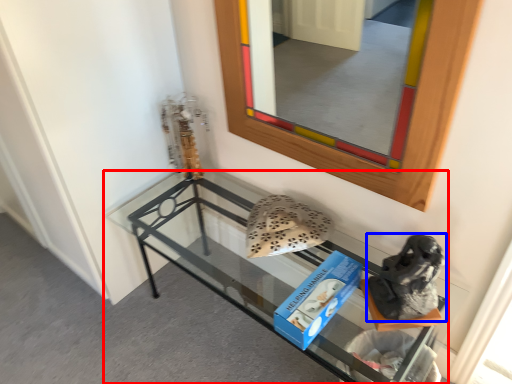
Question: Which object is closer to the camera taking this photo, shelf (highlighted by a red box) or footwear (highlighted by a blue box)?

Choices:
 (A) shelf
 (B) footwear

Answer: (A)